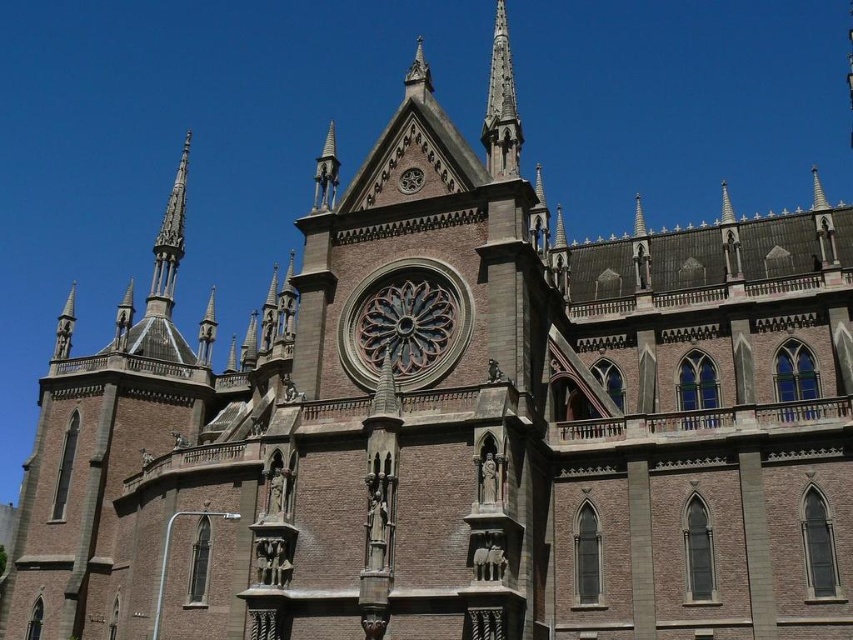
Question: Is smooth stone spire at upper center above carved stone spire at upper left?

Choices:
 (A) no
 (B) yes

Answer: (B)

Question: Which of the following is the farthest from the observer?

Choices:
 (A) (x=167, y=221)
 (B) (x=500, y=38)

Answer: (A)

Question: Is smooth stone spire at upper center bigger than carved stone spire at upper left?

Choices:
 (A) no
 (B) yes

Answer: (A)

Question: Which point is farther to the camera?

Choices:
 (A) (161, 256)
 (B) (505, 35)

Answer: (A)

Question: Does smooth stone spire at upper center appear under carved stone spire at upper left?

Choices:
 (A) yes
 (B) no

Answer: (B)